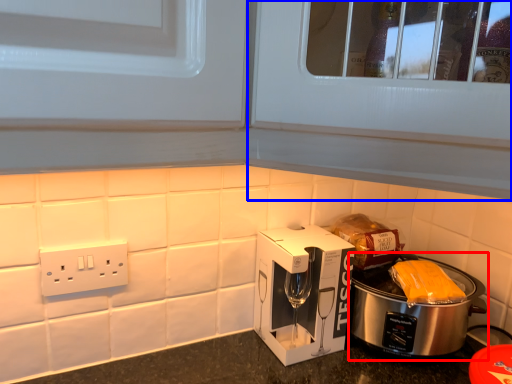
Question: Which object is further to the camera taking this photo, slow cooker (highlighted by a red box) or glass door (highlighted by a blue box)?

Choices:
 (A) slow cooker
 (B) glass door

Answer: (A)